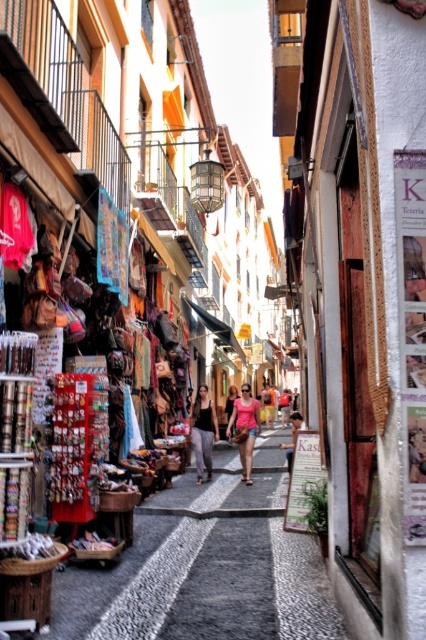
Question: Which of the following is the closest to the observer?

Choices:
 (A) (199, 611)
 (B) (249, 404)
 (C) (213, 416)

Answer: (A)

Question: Which point is farther to the camera?

Choices:
 (A) matte black tank top at center
 (B) pink fabric shorts at center
 (C) smooth stone alley at center

Answer: (A)

Question: Does smooth stone alley at center have a smaller size compared to matte black tank top at center?

Choices:
 (A) no
 (B) yes

Answer: (A)

Question: Does pink fabric shorts at center have a smaller size compared to matte black tank top at center?

Choices:
 (A) yes
 (B) no

Answer: (A)

Question: Estimate the real-world distances between objects in this image. Which object is closer to the matte black tank top at center?

Choices:
 (A) pink fabric shorts at center
 (B) smooth stone alley at center

Answer: (A)

Question: Can you confirm if pink fabric shorts at center is positioned to the right of matte black tank top at center?

Choices:
 (A) no
 (B) yes

Answer: (B)